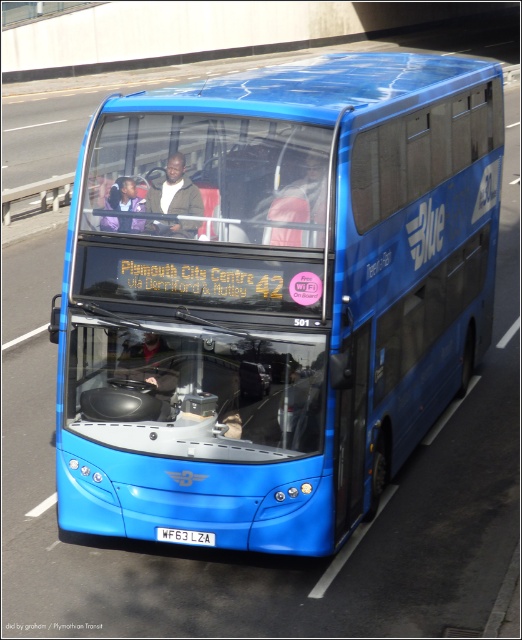
Question: Can you confirm if blue metallic bus at center is thinner than khaki fabric jacket at center?

Choices:
 (A) no
 (B) yes

Answer: (A)

Question: Which point is closer to the camera?

Choices:
 (A) white matte license plate at center
 (B) khaki fabric jacket at center
 (C) blue metallic bus at center

Answer: (C)

Question: Can you confirm if blue metallic bus at center is positioned above white matte license plate at center?

Choices:
 (A) no
 (B) yes

Answer: (B)

Question: Which object appears closest to the camera in this image?

Choices:
 (A) blue metallic bus at center
 (B) white matte license plate at center

Answer: (A)

Question: Is blue metallic bus at center below white matte license plate at center?

Choices:
 (A) no
 (B) yes

Answer: (A)

Question: Among these points, which one is farthest from the camera?

Choices:
 (A) (183, 189)
 (B) (394, 454)

Answer: (B)